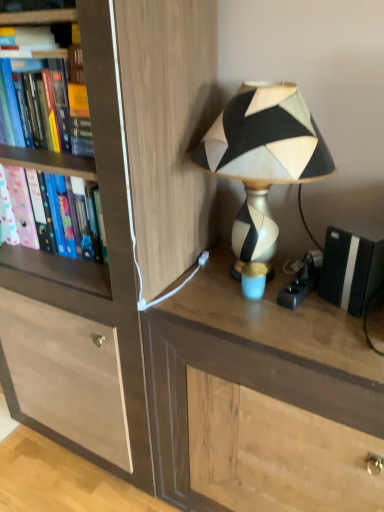
At what (x,y) coordinates should I click in order to perform the action: click on pink matte folder at left, the second book when ordered from top to bottom. Please return your answer as a coordinate pair (x, y). This screenshot has width=384, height=512. Looking at the image, I should click on (39, 211).

The height and width of the screenshot is (512, 384). Identify the location of brown wood desk at center. (261, 399).

What are the coordinates of `black and white geometric lampshade at upper right` in the screenshot? It's located at (263, 157).

What is the approximate height of black and white geometric lampshade at upper right?

20.73 inches.

Locate an element on the screen. This screenshot has height=512, width=384. black matte speaker at right is located at coordinates [x=352, y=266].

Between black matte speaker at right and brown wood desk at center, which one has smaller width?

With smaller width is black matte speaker at right.

Is black matte speaker at right far from brown wood desk at center?

No, there isn't a large distance between black matte speaker at right and brown wood desk at center.

Is black matte speaker at right closer to the viewer compared to brown wood desk at center?

No, the depth of black matte speaker at right is greater than that of brown wood desk at center.

Is black matte speaker at right not within brown wood desk at center?

That's correct, black matte speaker at right is outside of brown wood desk at center.

From the image's perspective, is wooden cabinet at center above or below hardcover book at left, positioned as the 1th book in top-to-bottom order?

Clearly, from the image's perspective, wooden cabinet at center is below hardcover book at left, positioned as the 1th book in top-to-bottom order.

From a real-world perspective, between wooden cabinet at center and hardcover book at left, positioned as the 1th book in top-to-bottom order, who is vertically higher?

In real-world perspective, hardcover book at left, positioned as the 1th book in top-to-bottom order, is above.

Image resolution: width=384 pixels, height=512 pixels. Find the location of `the 1st book behind the wooden cabinet at center`. the 1st book behind the wooden cabinet at center is located at coordinates (45, 86).

In terms of height, does wooden cabinet at center look taller or shorter compared to hardcover book at left, which is the second book in bottom-to-top order?

Considering their sizes, wooden cabinet at center has more height than hardcover book at left, which is the second book in bottom-to-top order.

Is pink matte folder at left, the second book when ordered from top to bottom, touching brown wood desk at center?

There is a gap between pink matte folder at left, the second book when ordered from top to bottom, and brown wood desk at center.

Does pink matte folder at left, the second book when ordered from top to bottom, have a smaller size compared to brown wood desk at center?

Yes, pink matte folder at left, the second book when ordered from top to bottom, is smaller than brown wood desk at center.

Which of these two, pink matte folder at left, the second book when ordered from top to bottom, or brown wood desk at center, is wider?

With larger width is brown wood desk at center.

Is point (61, 218) farther from camera compared to point (236, 465)?

Yes, point (61, 218) is farther from viewer.

Which object is thinner, black matte speaker at right or black and white geometric lampshade at upper right?

black matte speaker at right.

Which object is more forward, black matte speaker at right or black and white geometric lampshade at upper right?

black and white geometric lampshade at upper right.

Would you say black matte speaker at right is outside black and white geometric lampshade at upper right?

Yes.

From the image's perspective, is black matte speaker at right over black and white geometric lampshade at upper right?

Incorrect, from the image's perspective, black matte speaker at right is lower than black and white geometric lampshade at upper right.

Consider the image. Between black and white geometric lampshade at upper right and brown wood desk at center, which one has smaller size?

black and white geometric lampshade at upper right.

From a real-world perspective, is black and white geometric lampshade at upper right above or below brown wood desk at center?

black and white geometric lampshade at upper right is situated higher than brown wood desk at center in the real world.

Is brown wood desk at center surrounded by black and white geometric lampshade at upper right?

That's incorrect, brown wood desk at center is not inside black and white geometric lampshade at upper right.

Locate an element on the screen. The height and width of the screenshot is (512, 384). lamp above the brown wood desk at center (from a real-world perspective) is located at coordinates (263, 157).

Can you confirm if hardcover book at left, which is the second book in bottom-to-top order, is bigger than pink matte folder at left, the 1th book when ordered from bottom to top?

No.

You are a GUI agent. You are given a task and a screenshot of the screen. Output one action in this format:
    pyautogui.click(x=<x>, y=<y>)
    Task: Click on the book lying above the pink matte folder at left, the 1th book when ordered from bottom to top (from the image's perspective)
    The width and height of the screenshot is (384, 512).
    Given the screenshot: What is the action you would take?
    pyautogui.click(x=45, y=86)

From the image's perspective, relative to pink matte folder at left, the 1th book when ordered from bottom to top, is hardcover book at left, which is the second book in bottom-to-top order, above or below?

Based on their image positions, hardcover book at left, which is the second book in bottom-to-top order, is located above pink matte folder at left, the 1th book when ordered from bottom to top.

Is point (31, 127) farther from camera compared to point (38, 244)?

No, it is not.

How far apart are pink matte folder at left, the second book when ordered from top to bottom, and wooden cabinet at center?

pink matte folder at left, the second book when ordered from top to bottom, is 10.32 inches from wooden cabinet at center.

Is wooden cabinet at center surrounded by pink matte folder at left, the second book when ordered from top to bottom?

That's incorrect, wooden cabinet at center is not inside pink matte folder at left, the second book when ordered from top to bottom.

From a real-world perspective, which object rests below the other?

wooden cabinet at center is physically lower.

Locate an element on the screen. desk directly beneath the black matte speaker at right (from a real-world perspective) is located at coordinates (261, 399).

Locate an element on the screen. book that is the 1st one when counting leftward from the wooden cabinet at center is located at coordinates tap(45, 86).

In the scene shown: Estimate the real-world distances between objects in this image. Which object is further from pink matte folder at left, the 1th book when ordered from bottom to top, black and white geometric lampshade at upper right or hardcover book at left, positioned as the 1th book in top-to-bottom order?

black and white geometric lampshade at upper right.

Estimate the real-world distances between objects in this image. Which object is further from black and white geometric lampshade at upper right, brown wood desk at center or black matte speaker at right?

Among the two, brown wood desk at center is located further to black and white geometric lampshade at upper right.

Looking at the image, which one is located further to black and white geometric lampshade at upper right, hardcover book at left, positioned as the 1th book in top-to-bottom order, or wooden cabinet at center?

hardcover book at left, positioned as the 1th book in top-to-bottom order, lies further to black and white geometric lampshade at upper right than the other object.

From the image, which object appears to be nearer to brown wood desk at center, pink matte folder at left, the second book when ordered from top to bottom, or black matte speaker at right?

The object closer to brown wood desk at center is black matte speaker at right.

From the image, which object appears to be farther from wooden cabinet at center, black and white geometric lampshade at upper right or brown wood desk at center?

black and white geometric lampshade at upper right is positioned further to the anchor wooden cabinet at center.

When comparing their distances from brown wood desk at center, does hardcover book at left, positioned as the 1th book in top-to-bottom order, or wooden cabinet at center seem further?

hardcover book at left, positioned as the 1th book in top-to-bottom order, is positioned further to the anchor brown wood desk at center.

From the picture: Estimate the real-world distances between objects in this image. Which object is further from pink matte folder at left, the second book when ordered from top to bottom, black matte speaker at right or wooden cabinet at center?

black matte speaker at right lies further to pink matte folder at left, the second book when ordered from top to bottom, than the other object.

Based on their spatial positions, is hardcover book at left, which is the second book in bottom-to-top order, or pink matte folder at left, the second book when ordered from top to bottom, closer to black and white geometric lampshade at upper right?

hardcover book at left, which is the second book in bottom-to-top order, is positioned closer to the anchor black and white geometric lampshade at upper right.

The height and width of the screenshot is (512, 384). I want to click on desk located between wooden cabinet at center and black matte speaker at right in the left-right direction, so click(x=261, y=399).

Identify the location of cabinetry between pink matte folder at left, the second book when ordered from top to bottom, and black and white geometric lampshade at upper right, in the horizontal direction. Image resolution: width=384 pixels, height=512 pixels. (84, 300).

Identify the location of book between wooden cabinet at center and pink matte folder at left, the 1th book when ordered from bottom to top, from front to back. (45, 86).

The image size is (384, 512). I want to click on lamp that lies between hardcover book at left, which is the second book in bottom-to-top order, and brown wood desk at center from top to bottom, so click(x=263, y=157).